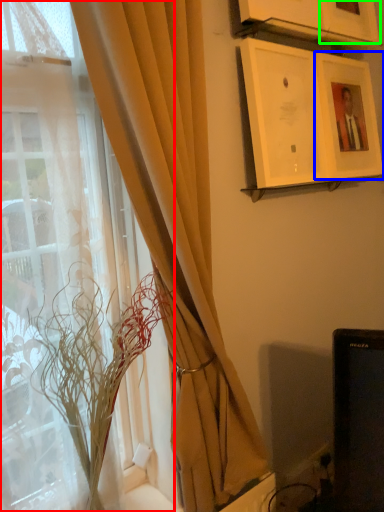
Question: Considering the real-world distances, which object is farthest from window (highlighted by a red box)? picture frame (highlighted by a blue box) or picture frame (highlighted by a green box)?

Choices:
 (A) picture frame
 (B) picture frame

Answer: (B)